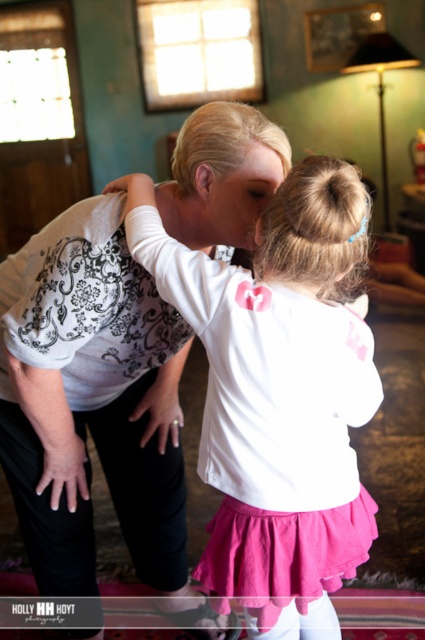
Question: Among these points, which one is farthest from the camera?

Choices:
 (A) (272, 260)
 (B) (84, 355)

Answer: (B)

Question: Is the position of white lace shirt at center more distant than that of white matte shirt at center?

Choices:
 (A) no
 (B) yes

Answer: (B)

Question: Considering the relative positions of white lace shirt at center and white matte shirt at center in the image provided, where is white lace shirt at center located with respect to white matte shirt at center?

Choices:
 (A) right
 (B) left

Answer: (B)

Question: Is white lace shirt at center further to camera compared to white matte shirt at center?

Choices:
 (A) yes
 (B) no

Answer: (A)

Question: Among these objects, which one is farthest from the camera?

Choices:
 (A) white matte shirt at center
 (B) white lace shirt at center

Answer: (B)